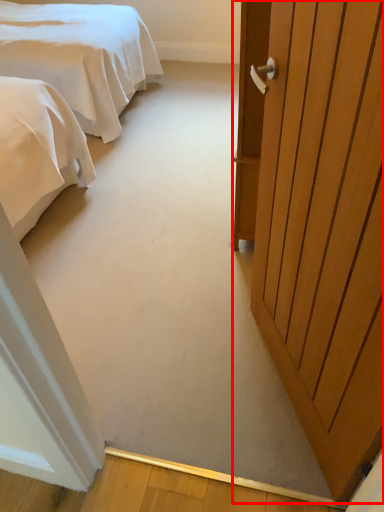
Question: From the image's perspective, what is the correct spatial relationship of door (annotated by the red box) in relation to bed?

Choices:
 (A) below
 (B) above

Answer: (A)